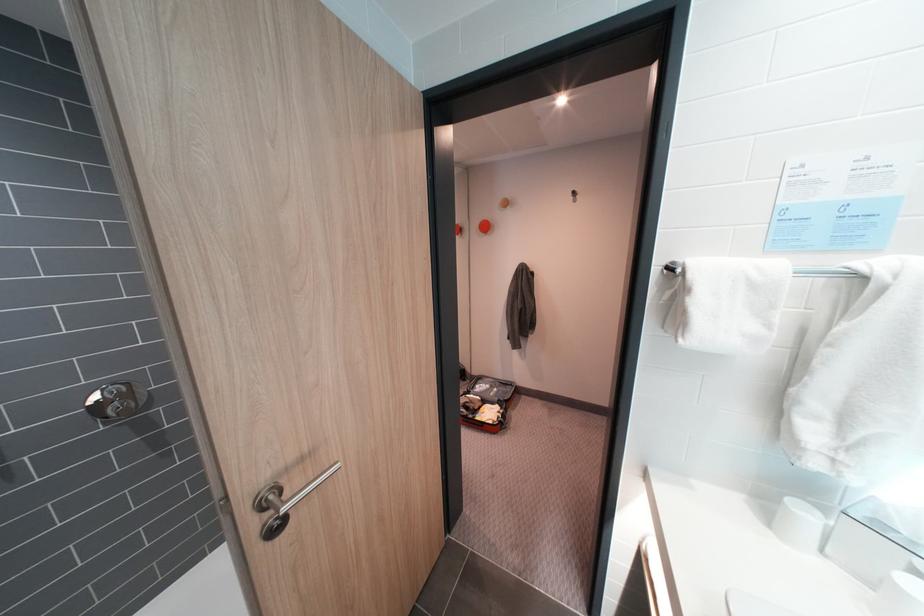
You are a GUI agent. You are given a task and a screenshot of the screen. Output one action in this format:
    pyautogui.click(x=<x>, y=<y>)
    Task: Click on the wooden wall hook
    
    Given the screenshot: What is the action you would take?
    pyautogui.click(x=284, y=503)